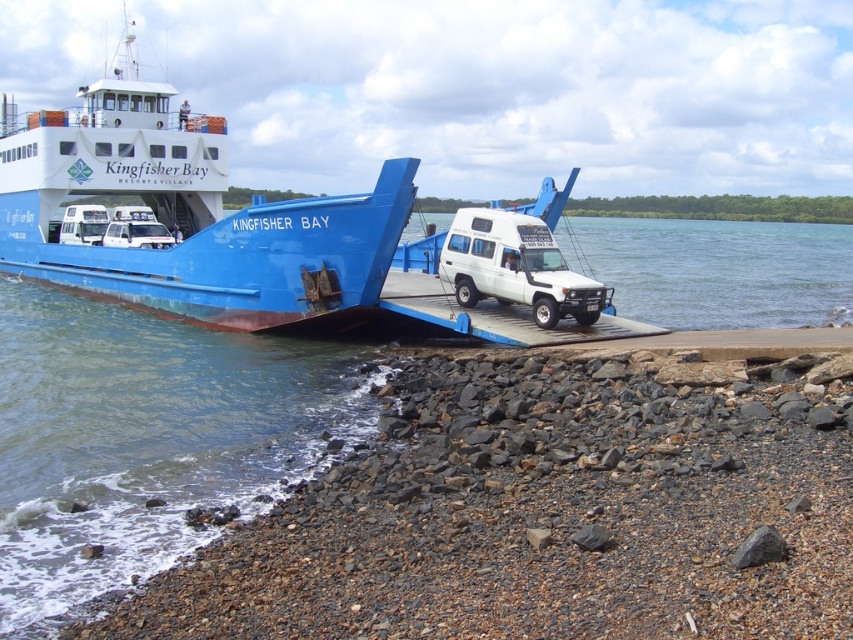
Is blue matte ferry at center shorter than white matte truck at center?

Incorrect, blue matte ferry at center's height does not fall short of white matte truck at center's.

The width and height of the screenshot is (853, 640). In order to click on blue matte ferry at center in this screenshot , I will do `click(184, 216)`.

Which is in front, point (177, 150) or point (497, 234)?

Point (497, 234)

Locate an element on the screen. This screenshot has width=853, height=640. blue matte ferry at center is located at coordinates (184, 216).

Is point (709, 444) farther from viewer compared to point (711, 296)?

No.

Who is higher up, smooth pebbles at lower left or white glossy water at center?

white glossy water at center

Measure the distance between smooth pebbles at lower left and camera.

smooth pebbles at lower left is 16.86 feet from camera.

Identify the location of smooth pebbles at lower left. The width and height of the screenshot is (853, 640). (538, 516).

Does smooth pebbles at lower left come in front of white matte truck at center?

Yes, smooth pebbles at lower left is in front of white matte truck at center.

What do you see at coordinates (538, 516) in the screenshot? I see `smooth pebbles at lower left` at bounding box center [538, 516].

Locate an element on the screen. This screenshot has width=853, height=640. smooth pebbles at lower left is located at coordinates (538, 516).